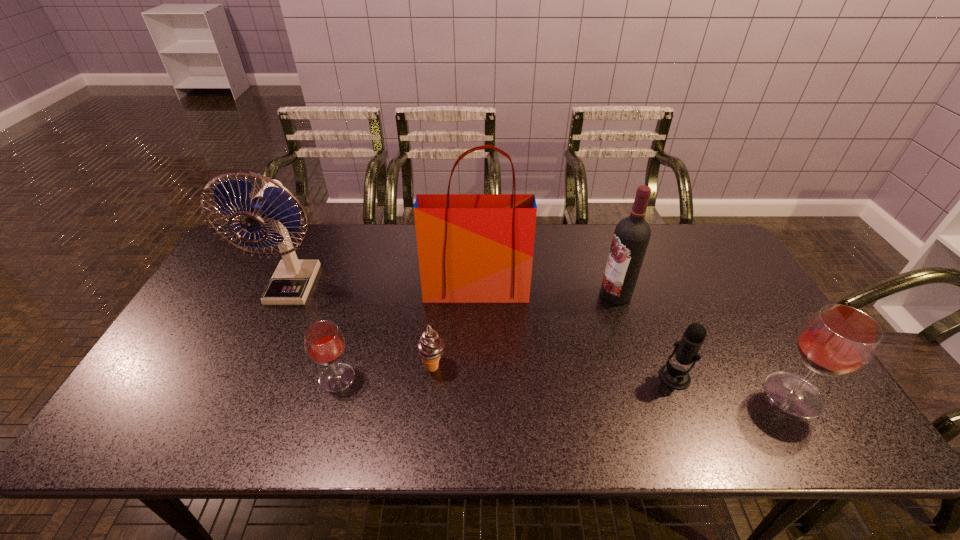
The image size is (960, 540). I want to click on free space located 0.240m on the left of the fourth shortest object, so click(x=666, y=395).

The width and height of the screenshot is (960, 540). Find the location of `free space located on the front-facing side of the leftmost object`. free space located on the front-facing side of the leftmost object is located at coordinates (271, 334).

The width and height of the screenshot is (960, 540). Find the location of `vacant space located on the handle side of the shopping bag`. vacant space located on the handle side of the shopping bag is located at coordinates (476, 327).

At what (x,y) coordinates should I click in order to perform the action: click on free location located on the label of the wine bottle. Please return your answer as a coordinate pair (x, y). Looking at the image, I should click on (516, 294).

Where is `vacant point located 0.180m on the label of the wine bottle`? This screenshot has height=540, width=960. vacant point located 0.180m on the label of the wine bottle is located at coordinates (540, 294).

Identify the location of free location located on the label of the wine bottle. (467, 294).

Where is `vacant space located on the left of the shortest object`? vacant space located on the left of the shortest object is located at coordinates (396, 367).

Locate an element on the screen. This screenshot has height=540, width=960. vacant space located on the back of the microphone is located at coordinates (657, 332).

Identify the location of object that is positioned at the far edge. The width and height of the screenshot is (960, 540). (292, 280).

I want to click on icecream located at the near edge, so 430,347.